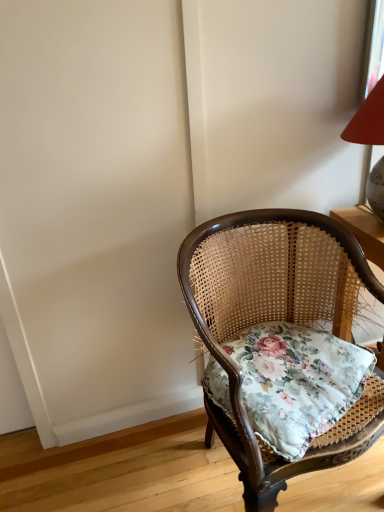
Question: From the image's perspective, relative to woven wood chair at center, is floral fabric cushion at center above or below?

Choices:
 (A) below
 (B) above

Answer: (B)

Question: Relative to woven wood chair at center, is floral fabric cushion at center in front or behind?

Choices:
 (A) behind
 (B) front

Answer: (A)

Question: From a real-world perspective, relative to woven wood chair at center, is floral fabric cushion at center vertically above or below?

Choices:
 (A) above
 (B) below

Answer: (A)

Question: Relative to floral fabric cushion at center, is woven wood chair at center in front or behind?

Choices:
 (A) behind
 (B) front

Answer: (B)

Question: Considering the positions of woven wood chair at center and floral fabric cushion at center in the image, is woven wood chair at center bigger or smaller than floral fabric cushion at center?

Choices:
 (A) big
 (B) small

Answer: (A)

Question: In terms of height, does woven wood chair at center look taller or shorter compared to floral fabric cushion at center?

Choices:
 (A) tall
 (B) short

Answer: (A)

Question: Is point (210, 244) positioned closer to the camera than point (289, 389)?

Choices:
 (A) closer
 (B) farther

Answer: (B)